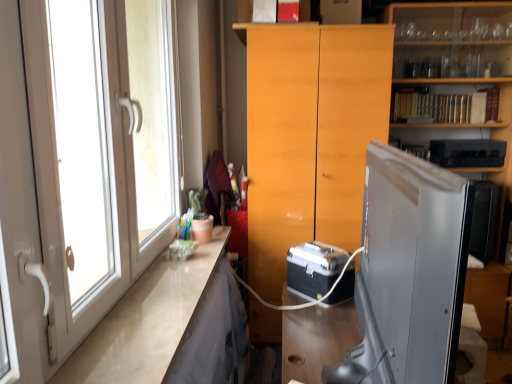
Image resolution: width=512 pixels, height=384 pixels. Identify the location of unoccupied region to the right of white glossy door at left. (154, 324).